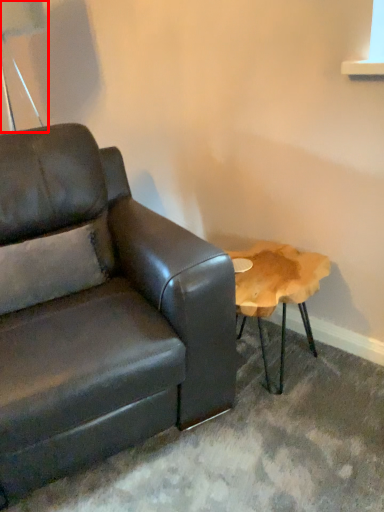
Question: Observing the image, what is the correct spatial positioning of table lamp (annotated by the red box) in reference to studio couch?

Choices:
 (A) right
 (B) left

Answer: (B)